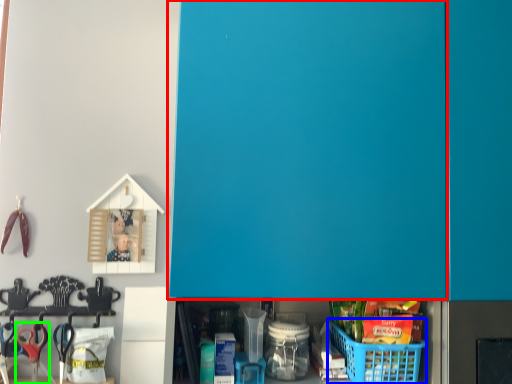
Question: Which object is the closest to the door (highlighted by a red box)? Choose among these: basket (highlighted by a blue box) or scissors (highlighted by a green box).

Choices:
 (A) basket
 (B) scissors

Answer: (A)